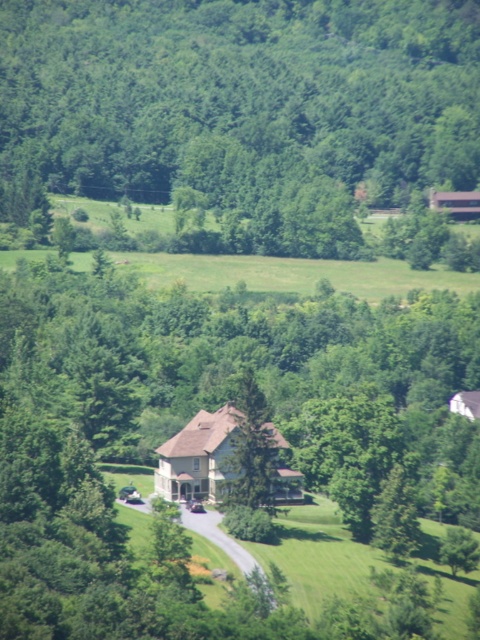
Is the position of green leafy tree at upper center more distant than that of green textured tree at center?

That is True.

Is green leafy tree at upper center to the right of green textured tree at center from the viewer's perspective?

No, green leafy tree at upper center is not to the right of green textured tree at center.

I want to click on green leafy tree at upper center, so click(x=244, y=104).